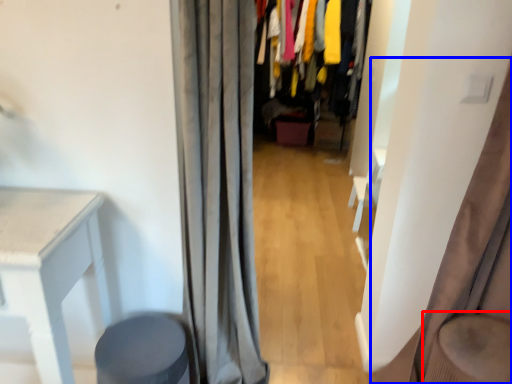
Question: Which of the following is the closest to the observer, swivel chair (highlighted by a red box) or curtain (highlighted by a blue box)?

Choices:
 (A) swivel chair
 (B) curtain

Answer: (B)